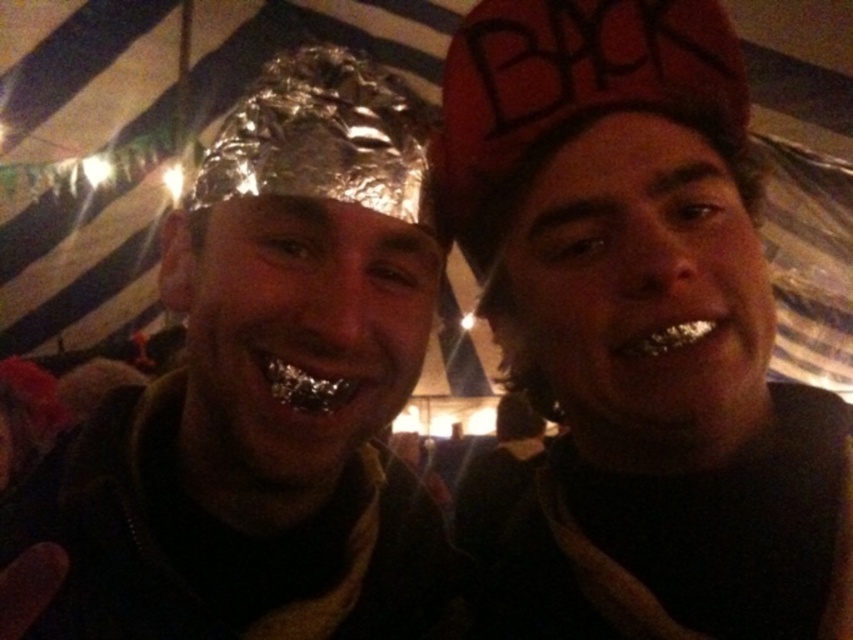
Question: Observing the image, what is the correct spatial positioning of shiny metallic foil hat at left in reference to silver metallic braces at center?

Choices:
 (A) above
 (B) below

Answer: (A)

Question: Which of the following is the closest to the observer?

Choices:
 (A) silver metallic braces at center
 (B) red fabric cap at right
 (C) shiny metallic foil hat at left

Answer: (C)

Question: Is shiny metallic foil at center wider than red fabric cap at right?

Choices:
 (A) no
 (B) yes

Answer: (A)

Question: Does silver metallic braces at center appear on the right side of metallic silver teeth at lower right?

Choices:
 (A) no
 (B) yes

Answer: (A)

Question: Which point is closer to the camera?

Choices:
 (A) (683, 342)
 (B) (178, 289)
 (C) (322, 378)
 (D) (447, 577)

Answer: (C)

Question: Among these objects, which one is farthest from the camera?

Choices:
 (A) shiny metallic foil hat at left
 (B) shiny metallic foil at center
 (C) red fabric cap at right

Answer: (C)